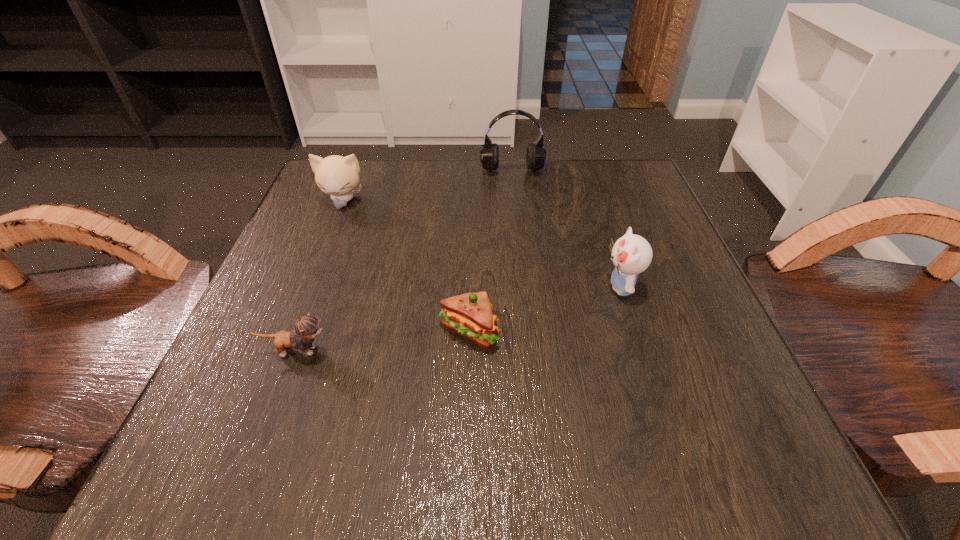
Locate an element on the screen. vacant region at the right edge is located at coordinates (723, 353).

You are a GUI agent. You are given a task and a screenshot of the screen. Output one action in this format:
    pyautogui.click(x=<x>, y=<y>)
    Task: Click on the vacant space at the far right corner of the desktop
    
    Given the screenshot: What is the action you would take?
    pyautogui.click(x=583, y=211)

At what (x,y) coordinates should I click in order to perform the action: click on vacant point located between the tallest object and the rightmost object. Please return your answer as a coordinate pair (x, y). The height and width of the screenshot is (540, 960). Looking at the image, I should click on (567, 233).

This screenshot has width=960, height=540. Find the location of `empty space that is in between the headset and the sandwich`. empty space that is in between the headset and the sandwich is located at coordinates (492, 255).

The image size is (960, 540). In order to click on empty space that is in between the rightmost object and the farthest kitten in this screenshot , I will do tap(482, 244).

Identify the location of vacant space in between the second nearest kitten and the tallest object. (567, 233).

Identify the location of empty space that is in between the sandwich and the third farthest object. (544, 309).

Identify the location of free area in between the farthest kitten and the sandwich. (406, 266).

Locate an element on the screen. The width and height of the screenshot is (960, 540). free point between the farthest kitten and the headset is located at coordinates (428, 190).

Choose which object is the second nearest neighbor to the sandwich. Please provide its 2D coordinates. Your answer should be formatted as a tuple, i.e. [(x, y)], where the tuple contains the x and y coordinates of a point satisfying the conditions above.

[(632, 254)]